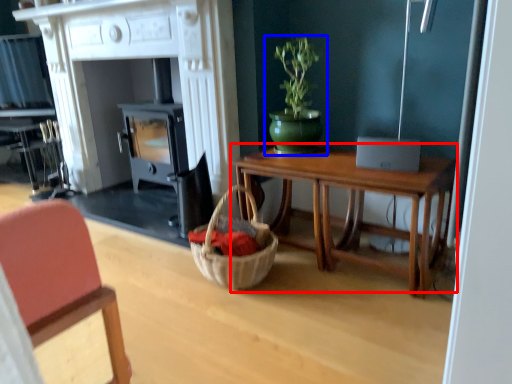
Question: Which object appears farthest to the camera in this image, table (highlighted by a red box) or houseplant (highlighted by a blue box)?

Choices:
 (A) table
 (B) houseplant

Answer: (B)